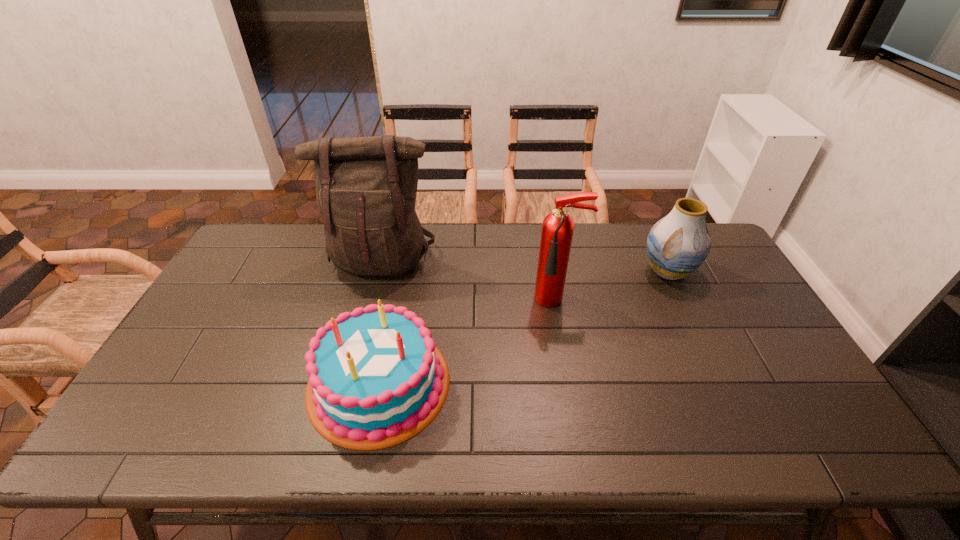
Identify which object is the second nearest to the fire extinguisher. Please provide its 2D coordinates. Your answer should be formatted as a tuple, i.e. [(x, y)], where the tuple contains the x and y coordinates of a point satisfying the conditions above.

[(374, 378)]

The height and width of the screenshot is (540, 960). Find the location of `free spot that satisfies the following two spatial constraints: 1. on the open flap of the birthday cake; 2. on the left side of the backpack`. free spot that satisfies the following two spatial constraints: 1. on the open flap of the birthday cake; 2. on the left side of the backpack is located at coordinates (349, 383).

Image resolution: width=960 pixels, height=540 pixels. Find the location of `free region that satisfies the following two spatial constraints: 1. on the open flap of the vase; 2. on the left side of the tallest object`. free region that satisfies the following two spatial constraints: 1. on the open flap of the vase; 2. on the left side of the tallest object is located at coordinates (378, 272).